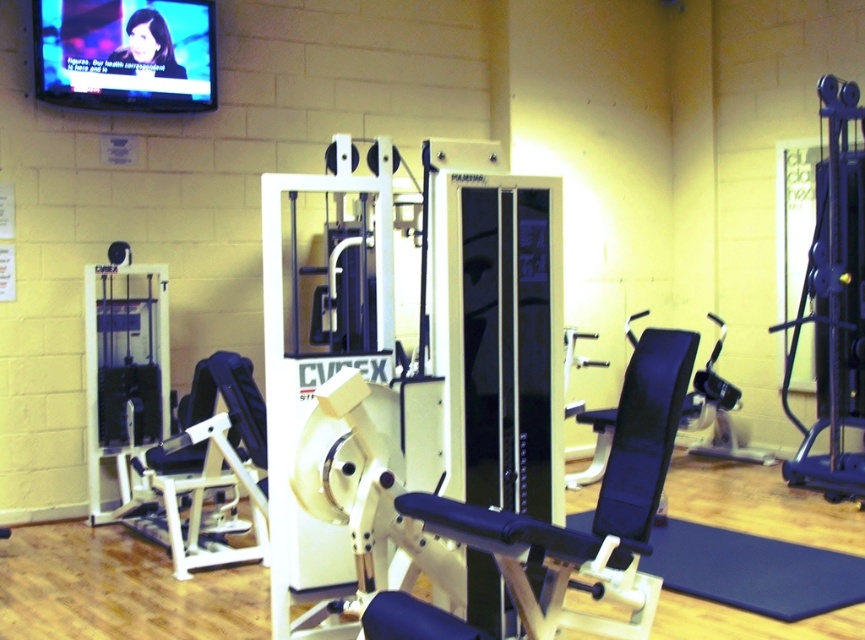
You are a gym member who wants to place a new yoga mat in the gym. The yoga mat needs to be placed in front of the matte black television at upper left. Is there space available where the blue rubber mat at lower right is currently located for this purpose?

The blue rubber mat at lower right is behind the matte black television at upper left, so placing the yoga mat in front of the television would require moving the blue rubber mat at lower right forward. The current location of the blue rubber mat at lower right is behind the TV, so there should be space in front of the TV to place the yoga mat if the blue rubber mat is moved.

From the picture: You are an interior designer assessing the gym layout. You need to determine if the matte black television at upper left can be placed on a shelf that can only accommodate items up to the size of the blue rubber mat at lower right. Based on their sizes, what would you advise?

The matte black television at upper left is bigger than the blue rubber mat at lower right, so it cannot fit on the shelf designed for items up to the size of the blue rubber mat at lower right.